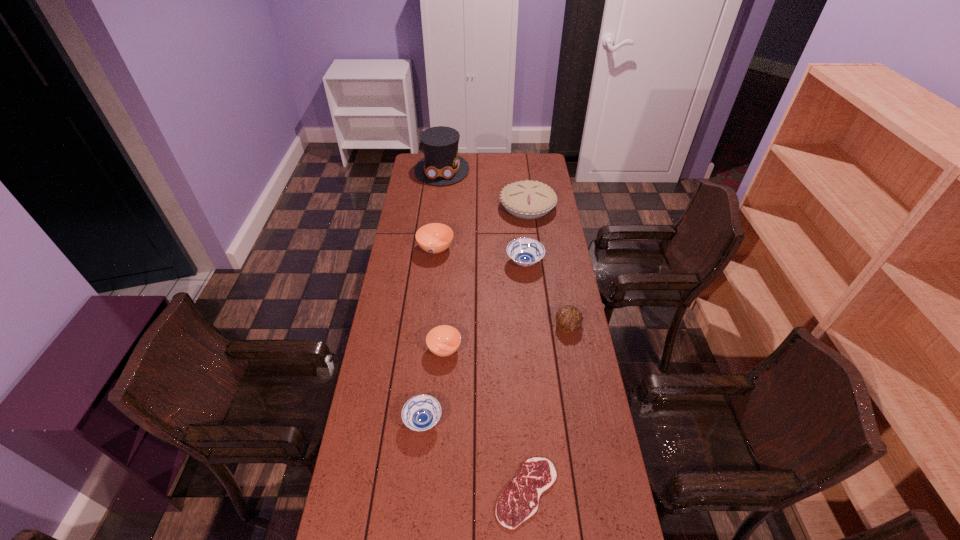
The width and height of the screenshot is (960, 540). In order to click on the smaller blue soup bowl in this screenshot , I will do `click(421, 412)`.

Where is `the nearer blue soup bowl`? Image resolution: width=960 pixels, height=540 pixels. the nearer blue soup bowl is located at coordinates (421, 412).

You are a GUI agent. You are given a task and a screenshot of the screen. Output one action in this format:
    pyautogui.click(x=<x>, y=<y>)
    Task: Click on the steak
    
    Given the screenshot: What is the action you would take?
    pyautogui.click(x=519, y=501)

You are a GUI agent. You are given a task and a screenshot of the screen. Output one action in this format:
    pyautogui.click(x=<x>, y=<y>)
    Task: Click on the shortest object
    The height and width of the screenshot is (540, 960).
    Given the screenshot: What is the action you would take?
    pyautogui.click(x=519, y=501)

I want to click on blank space located 0.130m with goggles on the front of the dress hat, so click(439, 201).

Identify the location of vacant point located on the front of the second farthest object. (531, 235).

Find the location of `free spot located 0.080m on the right of the farther peach soup bowl`. free spot located 0.080m on the right of the farther peach soup bowl is located at coordinates (471, 248).

Identify the location of free space located 0.140m on the left of the bigger blue soup bowl. click(x=474, y=263).

You are a GUI agent. You are given a task and a screenshot of the screen. Output one action in this format:
    pyautogui.click(x=<x>, y=<y>)
    Task: Click on the free spot located 0.310m on the back of the muffin
    
    Given the screenshot: What is the action you would take?
    pyautogui.click(x=557, y=261)

Identify the location of free space located 0.090m on the right of the nearer peach soup bowl. The height and width of the screenshot is (540, 960). (486, 349).